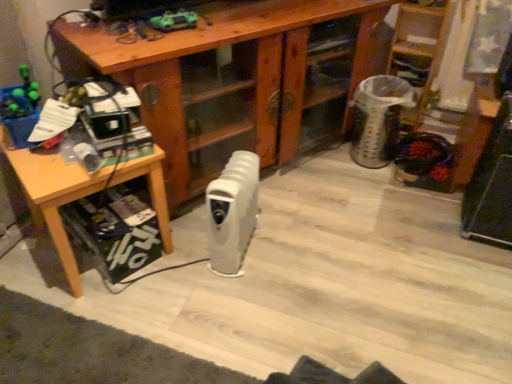
Question: Is wooden table at left inside the boundaries of wooden desk at center, or outside?

Choices:
 (A) outside
 (B) inside

Answer: (A)

Question: Considering the positions of point (96, 190) and point (261, 82), is point (96, 190) closer or farther from the camera than point (261, 82)?

Choices:
 (A) closer
 (B) farther

Answer: (A)

Question: Estimate the real-world distances between objects in this image. Which object is closer to the wooden ladder at upper right?

Choices:
 (A) white plastic radiator at center
 (B) wooden table at left
 (C) wooden desk at center

Answer: (C)

Question: Which of these objects is positioned farthest from the white plastic radiator at center?

Choices:
 (A) wooden table at left
 (B) wooden ladder at upper right
 (C) wooden desk at center

Answer: (B)